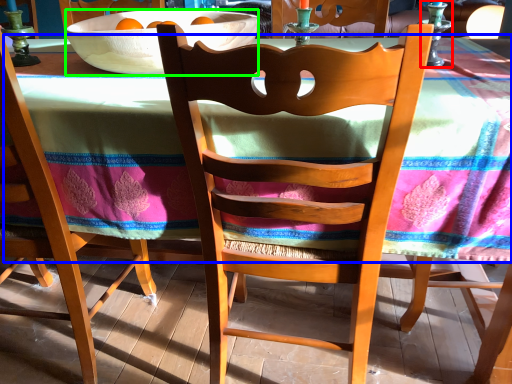
Question: Considering the real-world distances, which object is closest to candle holder (highlighted by a red box)? tablecloth (highlighted by a blue box) or bowl (highlighted by a green box).

Choices:
 (A) tablecloth
 (B) bowl

Answer: (A)